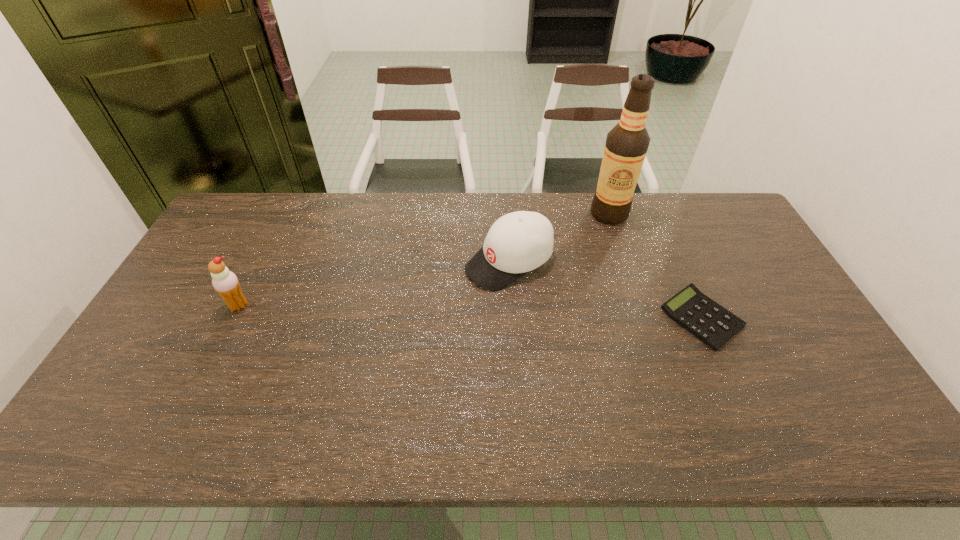
Locate an element on the screen. This screenshot has width=960, height=540. vacant point located between the second shortest object and the calculator is located at coordinates (605, 290).

At what (x,y) coordinates should I click in order to perform the action: click on object identified as the closest to the alcohol. Please return your answer as a coordinate pair (x, y). Image resolution: width=960 pixels, height=540 pixels. Looking at the image, I should click on (518, 242).

Where is `object that can be found as the second closest to the farthest object`? This screenshot has width=960, height=540. object that can be found as the second closest to the farthest object is located at coordinates (708, 321).

Find the location of `vacant space that satisfies the following two spatial constraints: 1. at the front with a straw on the icecream; 2. on the right side of the calculator`. vacant space that satisfies the following two spatial constraints: 1. at the front with a straw on the icecream; 2. on the right side of the calculator is located at coordinates (232, 318).

You are a GUI agent. You are given a task and a screenshot of the screen. Output one action in this format:
    pyautogui.click(x=<x>, y=<y>)
    Task: Click on the free location that satisfies the following two spatial constraints: 1. at the front with a straw on the calculator; 2. on the left side of the leftmost object
    This screenshot has height=540, width=960.
    Given the screenshot: What is the action you would take?
    pyautogui.click(x=232, y=318)